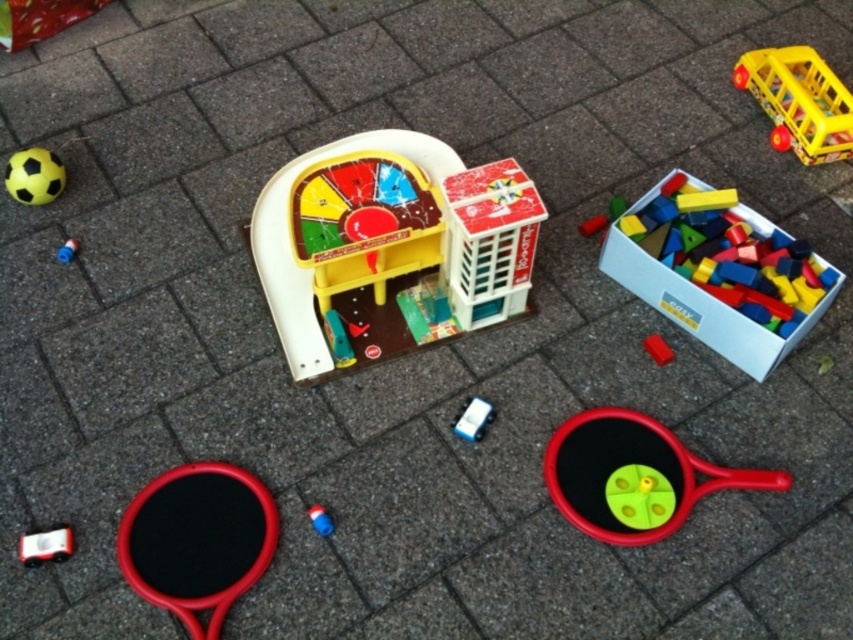
From the picture: You are a parent trying to organize the toys in the image. The yellow plastic toy bus at upper right needs to be placed into a storage bin located where the rubber matte block at center currently is. Is the distance between them sufficient for you to move the bus manually without needing to move other toys?

The yellow plastic toy bus at upper right and the rubber matte block at center are 28.11 inches apart from each other. Since this distance allows for easy manual handling, you can move the bus to the storage bin without needing to move other toys.